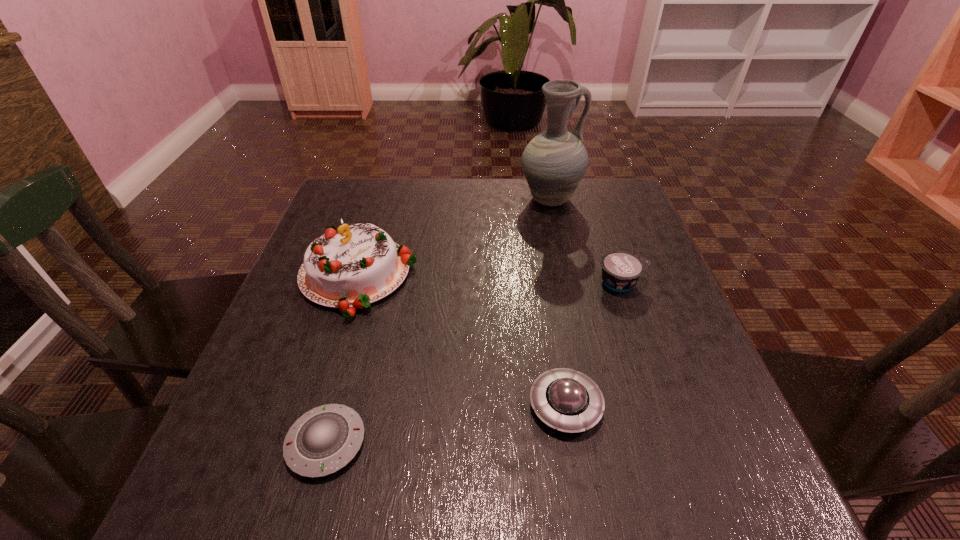
Identify the location of free location that satisfies the following two spatial constraints: 1. on the handle side of the farthest object; 2. on the front side of the right saucer. The height and width of the screenshot is (540, 960). (594, 406).

You are a GUI agent. You are given a task and a screenshot of the screen. Output one action in this format:
    pyautogui.click(x=<x>, y=<y>)
    Task: Click on the vacant space that satisfies the following two spatial constraints: 1. on the front side of the second tallest object; 2. on the left side of the taller saucer
    Image resolution: width=960 pixels, height=540 pixels.
    Given the screenshot: What is the action you would take?
    pyautogui.click(x=318, y=406)

The width and height of the screenshot is (960, 540). Find the location of `free space that satisfies the following two spatial constraints: 1. on the handle side of the pitcher; 2. on the right side of the yogurt`. free space that satisfies the following two spatial constraints: 1. on the handle side of the pitcher; 2. on the right side of the yogurt is located at coordinates (568, 282).